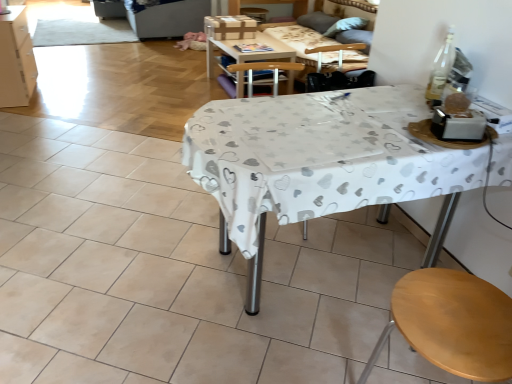
Question: Is white matte cabinet at left oriented away from wooden table at center?

Choices:
 (A) yes
 (B) no

Answer: (B)

Question: From a real-world perspective, is white matte cabinet at left under wooden table at center?

Choices:
 (A) yes
 (B) no

Answer: (B)

Question: Considering the relative sizes of white matte cabinet at left and wooden table at center in the image provided, is white matte cabinet at left bigger than wooden table at center?

Choices:
 (A) yes
 (B) no

Answer: (B)

Question: Is white matte cabinet at left positioned in front of wooden table at center?

Choices:
 (A) no
 (B) yes

Answer: (B)

Question: From the image's perspective, would you say white matte cabinet at left is positioned over wooden table at center?

Choices:
 (A) no
 (B) yes

Answer: (A)

Question: Relative to white matte cabinet at left, is white fabric-covered table at center in front or behind?

Choices:
 (A) behind
 (B) front

Answer: (B)

Question: In terms of height, does white fabric-covered table at center look taller or shorter compared to white matte cabinet at left?

Choices:
 (A) short
 (B) tall

Answer: (B)

Question: Would you say white fabric-covered table at center is inside or outside white matte cabinet at left?

Choices:
 (A) outside
 (B) inside

Answer: (A)

Question: In the image, is white fabric-covered table at center on the left side or the right side of white matte cabinet at left?

Choices:
 (A) left
 (B) right

Answer: (B)

Question: Considering the relative positions of wooden couch at upper center and white matte cabinet at left in the image provided, is wooden couch at upper center to the left or to the right of white matte cabinet at left?

Choices:
 (A) right
 (B) left

Answer: (A)

Question: From the image's perspective, relative to white matte cabinet at left, is wooden couch at upper center above or below?

Choices:
 (A) above
 (B) below

Answer: (B)

Question: From their relative heights in the image, would you say wooden couch at upper center is taller or shorter than white matte cabinet at left?

Choices:
 (A) short
 (B) tall

Answer: (A)

Question: From a real-world perspective, is wooden couch at upper center physically located above or below white matte cabinet at left?

Choices:
 (A) below
 (B) above

Answer: (B)

Question: Based on their sizes in the image, would you say white matte cabinet at left is bigger or smaller than white fabric-covered table at center?

Choices:
 (A) small
 (B) big

Answer: (A)

Question: Does point (0, 18) appear closer or farther from the camera than point (275, 213)?

Choices:
 (A) farther
 (B) closer

Answer: (A)